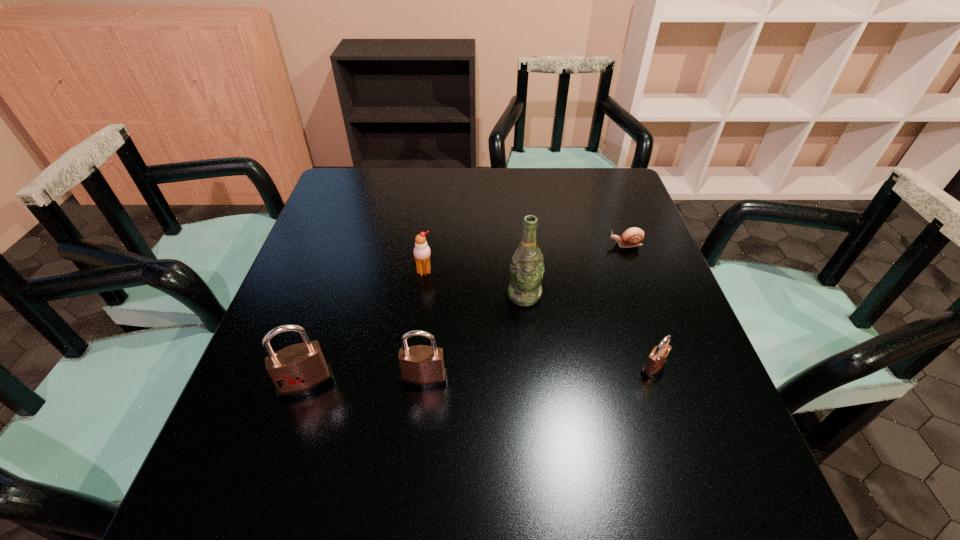
Find the location of `the second closest padlock relative to the third tallest object`. the second closest padlock relative to the third tallest object is located at coordinates (657, 359).

Locate an element on the screen. The height and width of the screenshot is (540, 960). free space in the image that satisfies the following two spatial constraints: 1. on the front-facing side of the shortest object; 2. on the surface of the tallest object is located at coordinates (644, 296).

Where is `vacant area in the image that satisfies the following two spatial constraints: 1. on the front-facing side of the shortest object; 2. on the front side of the leftmost object`? vacant area in the image that satisfies the following two spatial constraints: 1. on the front-facing side of the shortest object; 2. on the front side of the leftmost object is located at coordinates (677, 384).

Locate an element on the screen. The height and width of the screenshot is (540, 960). vacant point that satisfies the following two spatial constraints: 1. on the surface of the beer bottle; 2. on the left side of the rightmost padlock is located at coordinates (532, 368).